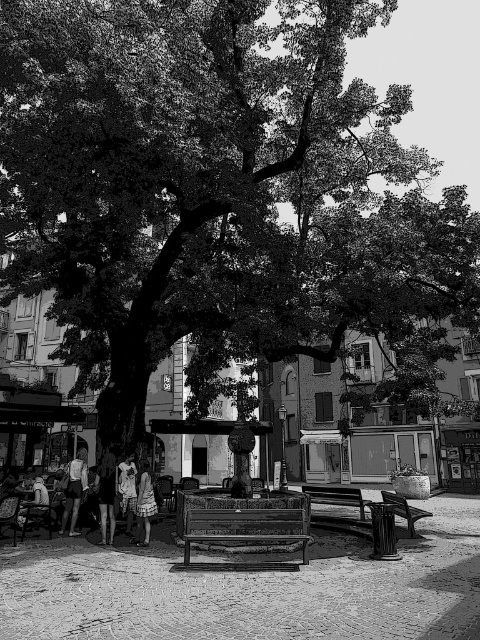
You are a photographer setting up equipment in the square. You have a matte black dress at lower left that you want to place on the rustic wood bench at center. Will the dress fit on the bench?

The rustic wood bench at center is larger in size than the matte black dress at lower left, so the dress will fit comfortably on the bench.

You are standing in the urban square and want to approach both the light brown fabric dress at center and the matte black dress at lower left. Which dress should you walk toward first to reach the one closer to you?

You should walk toward the light brown fabric dress at center first because it is closer to you than the matte black dress at lower left.

You are standing in the square and want to sit on the closest bench. Which bench should you choose between the rustic wood bench at center and the wooden bench at lower right?

The rustic wood bench at center is closer to the viewer than the wooden bench at lower right, so you should choose the rustic wood bench at center to sit on.